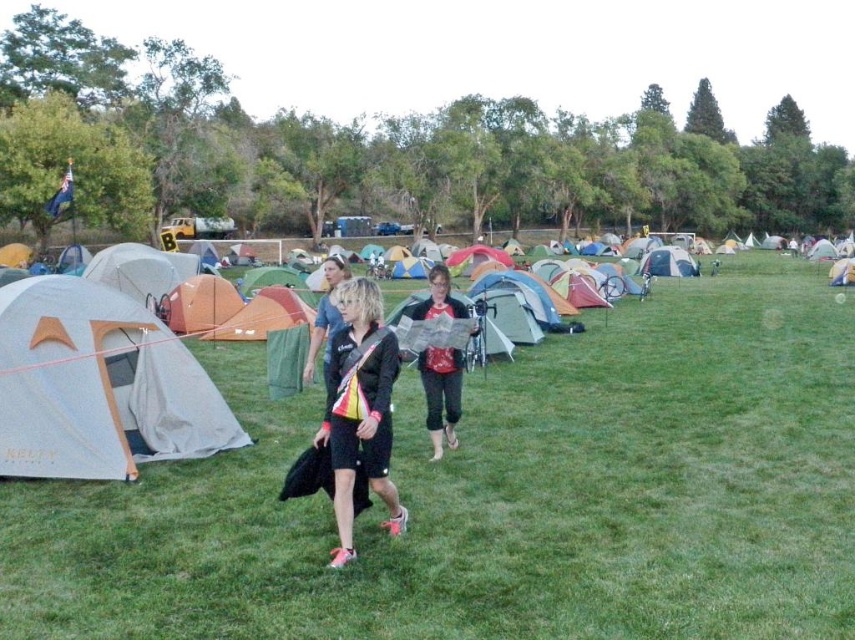
Locate an element on the screen. Image resolution: width=855 pixels, height=640 pixels. gray fabric tent at left is located at coordinates (98, 385).

Between gray fabric tent at left and black fabric jacket at center, which one has less height?

Standing shorter between the two is gray fabric tent at left.

Is point (1, 365) positioned behind point (327, 339)?

No, (1, 365) is closer to viewer.

Where is `gray fabric tent at left`? Image resolution: width=855 pixels, height=640 pixels. gray fabric tent at left is located at coordinates (98, 385).

Can you confirm if gray fabric tent at left is bigger than black matte jacket at center?

Yes.

Where is `gray fabric tent at left`? gray fabric tent at left is located at coordinates (98, 385).

Can you confirm if black matte jacket at center is taller than red fabric map at center?

Yes, black matte jacket at center is taller than red fabric map at center.

Is black matte jacket at center shorter than red fabric map at center?

In fact, black matte jacket at center may be taller than red fabric map at center.

Which is behind, point (392, 356) or point (457, 401)?

Positioned behind is point (457, 401).

Find the location of a particular element. This screenshot has height=640, width=855. black matte jacket at center is located at coordinates (360, 410).